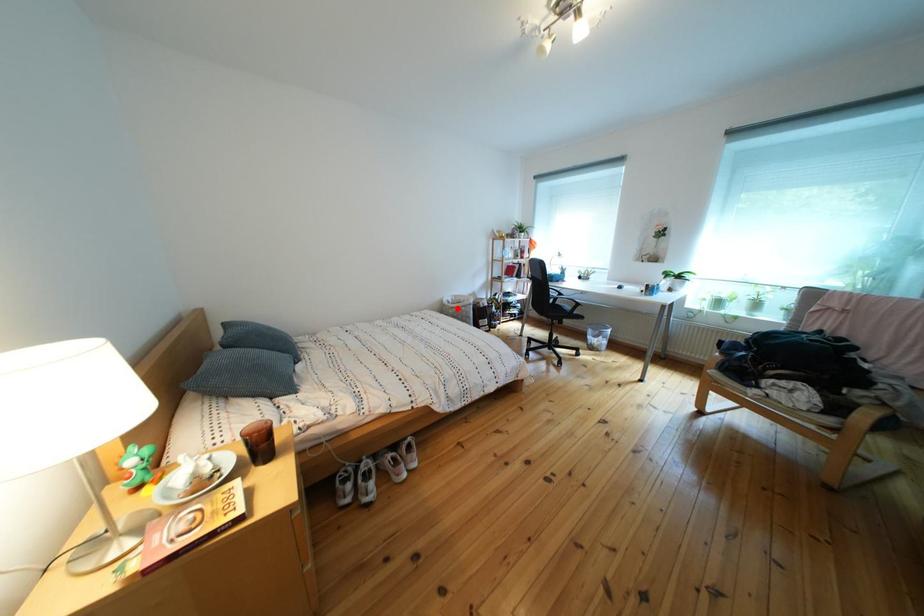
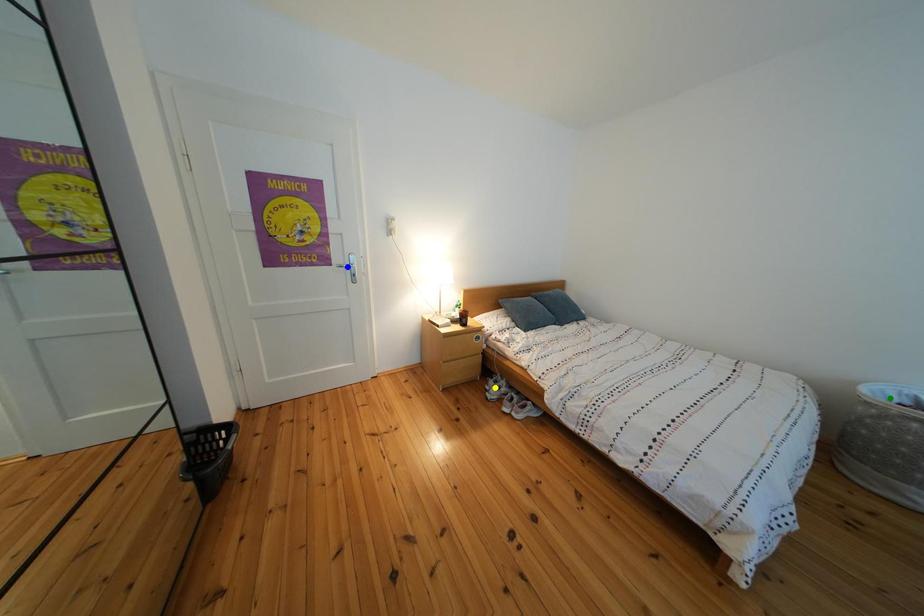
Question: I am providing you with two images of the same scene from different viewpoints. A red point is marked on the first image. You are given multiple points on the second image. Can you choose the point in image 2 that corresponds to the point in image 1?

Choices:
 (A) blue point
 (B) green point
 (C) yellow point

Answer: (B)